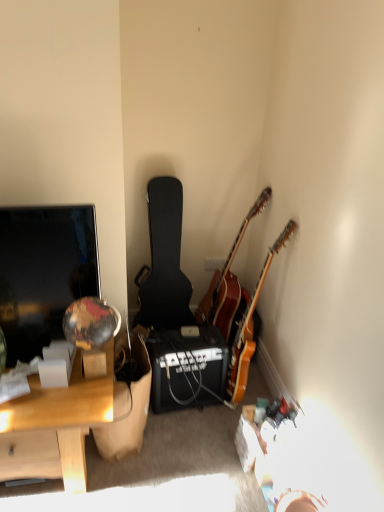
Image resolution: width=384 pixels, height=512 pixels. I want to click on free point in front of black matte amplifier at center, so click(x=199, y=435).